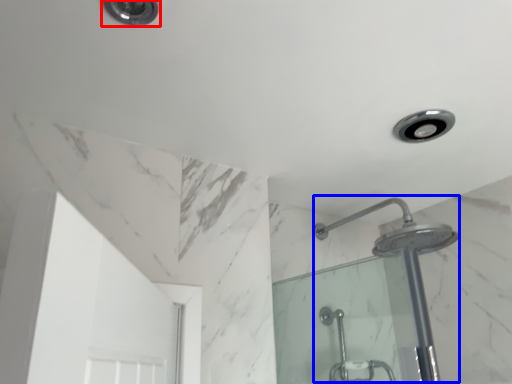
Question: Which of the following is the farthest to the observer, light fixture (highlighted by a red box) or shower (highlighted by a blue box)?

Choices:
 (A) light fixture
 (B) shower

Answer: (B)